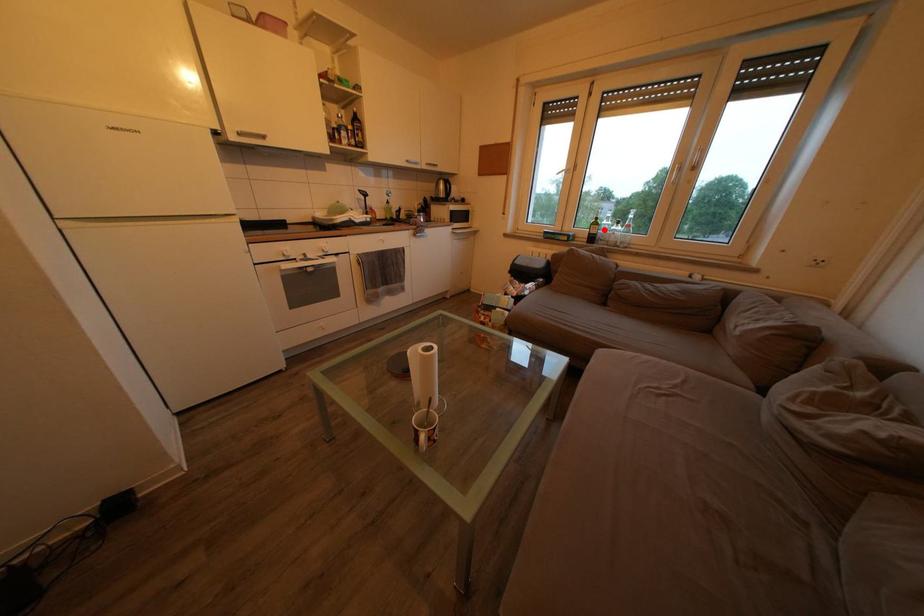
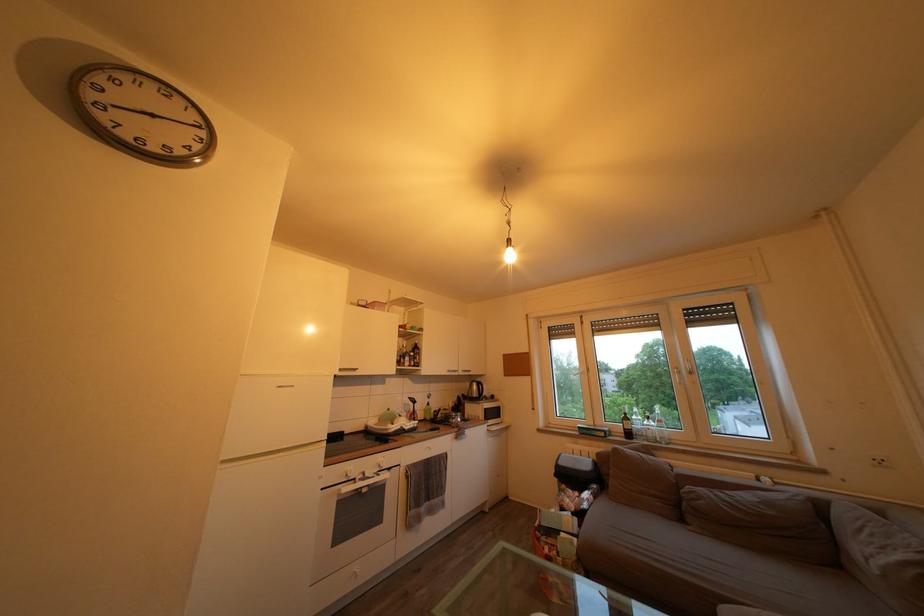
Question: I am providing you with two images of the same scene from different viewpoints. Given a red point in image1, look at the same physical point in image2. Is it:

Choices:
 (A) Closer to the viewpoint
 (B) Farther from the viewpoint

Answer: (B)